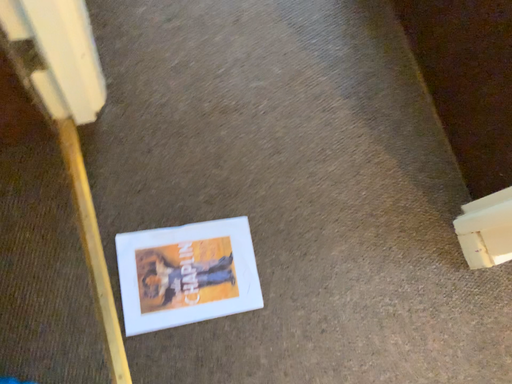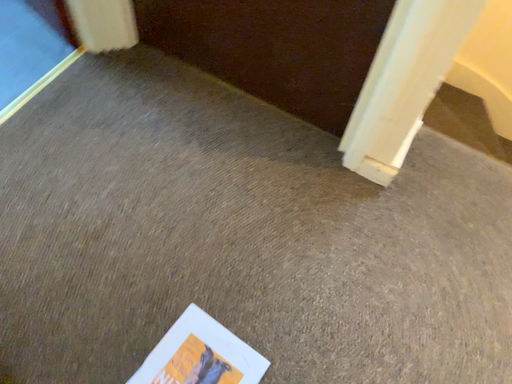
Question: Which way did the camera rotate in the video?

Choices:
 (A) rotated upward
 (B) rotated downward

Answer: (A)